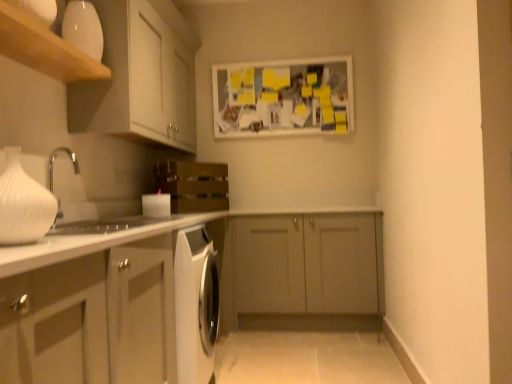
Question: From the image's perspective, would you say matte gray cabinet at center, acting as the 2th cabinetry starting from the top, is positioned over white matte cabinet at upper left, marked as the third cabinetry in a bottom-to-top arrangement?

Choices:
 (A) no
 (B) yes

Answer: (A)

Question: Is matte gray cabinet at center, acting as the 2th cabinetry starting from the top, bigger than white matte cabinet at upper left, positioned as the first cabinetry in top-to-bottom order?

Choices:
 (A) no
 (B) yes

Answer: (A)

Question: Does matte gray cabinet at center, acting as the 2th cabinetry starting from the top, have a lesser height compared to white matte cabinet at upper left, marked as the third cabinetry in a bottom-to-top arrangement?

Choices:
 (A) yes
 (B) no

Answer: (B)

Question: Would you say matte gray cabinet at center, acting as the 2th cabinetry starting from the top, is outside white matte cabinet at upper left, marked as the third cabinetry in a bottom-to-top arrangement?

Choices:
 (A) yes
 (B) no

Answer: (A)

Question: Would you say matte gray cabinet at center, acting as the 2th cabinetry starting from the top, contains white matte cabinet at upper left, positioned as the first cabinetry in top-to-bottom order?

Choices:
 (A) yes
 (B) no

Answer: (B)

Question: Considering the positions of white matte cabinet at lower left, marked as the first cabinetry in a bottom-to-top arrangement, and white matte cabinet at upper left, marked as the third cabinetry in a bottom-to-top arrangement, in the image, is white matte cabinet at lower left, marked as the first cabinetry in a bottom-to-top arrangement, taller or shorter than white matte cabinet at upper left, marked as the third cabinetry in a bottom-to-top arrangement,?

Choices:
 (A) short
 (B) tall

Answer: (B)

Question: From the image's perspective, is white matte cabinet at lower left, marked as the first cabinetry in a bottom-to-top arrangement, located above or below white matte cabinet at upper left, positioned as the first cabinetry in top-to-bottom order?

Choices:
 (A) below
 (B) above

Answer: (A)

Question: Based on their sizes in the image, would you say white matte cabinet at lower left, marked as the first cabinetry in a bottom-to-top arrangement, is bigger or smaller than white matte cabinet at upper left, positioned as the first cabinetry in top-to-bottom order?

Choices:
 (A) big
 (B) small

Answer: (B)

Question: Is white matte cabinet at lower left, positioned as the third cabinetry in top-to-bottom order, inside the boundaries of white matte cabinet at upper left, marked as the third cabinetry in a bottom-to-top arrangement, or outside?

Choices:
 (A) outside
 (B) inside

Answer: (A)

Question: Is white matte cabinet at upper left, positioned as the first cabinetry in top-to-bottom order, spatially inside white matte vase at left, or outside of it?

Choices:
 (A) outside
 (B) inside

Answer: (A)

Question: Is white matte cabinet at upper left, positioned as the first cabinetry in top-to-bottom order, in front of or behind white matte vase at left in the image?

Choices:
 (A) behind
 (B) front

Answer: (A)

Question: Considering the relative positions of white matte cabinet at upper left, positioned as the first cabinetry in top-to-bottom order, and white matte vase at left in the image provided, is white matte cabinet at upper left, positioned as the first cabinetry in top-to-bottom order, to the left or to the right of white matte vase at left?

Choices:
 (A) right
 (B) left

Answer: (B)

Question: From a real-world perspective, is white matte cabinet at upper left, marked as the third cabinetry in a bottom-to-top arrangement, above or below white matte vase at left?

Choices:
 (A) above
 (B) below

Answer: (A)

Question: Does point (309, 76) appear closer or farther from the camera than point (376, 306)?

Choices:
 (A) farther
 (B) closer

Answer: (A)

Question: In the image, is white matte bulletin board at upper center on the left side or the right side of matte gray cabinet at center, acting as the 2th cabinetry starting from the top?

Choices:
 (A) left
 (B) right

Answer: (A)